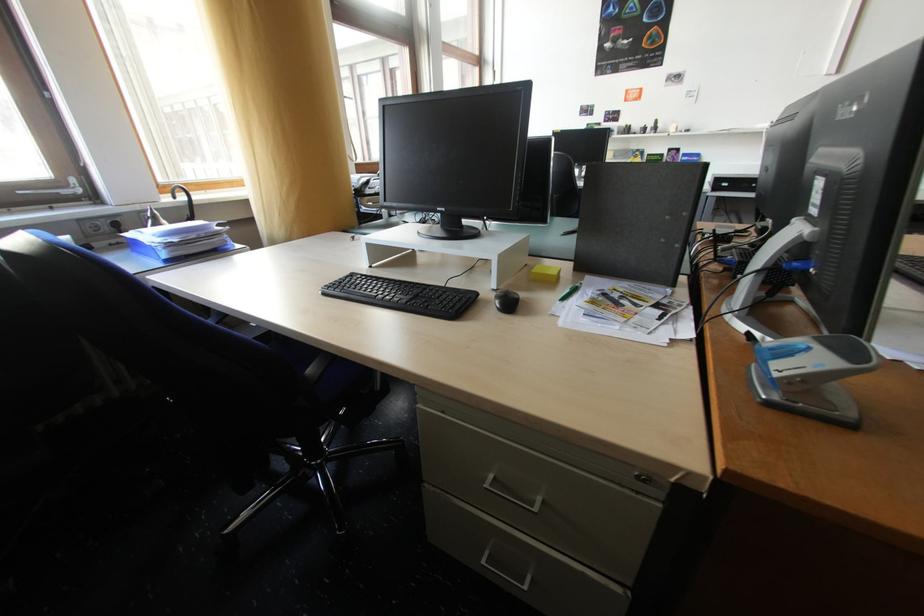
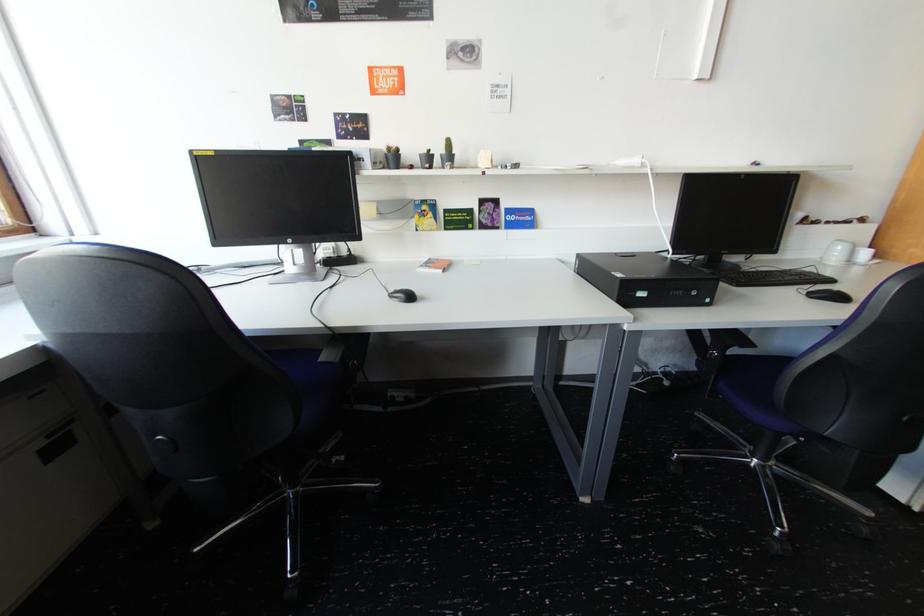
The point at (661, 127) is marked in the first image. Where is the corresponding point in the second image?

(452, 152)